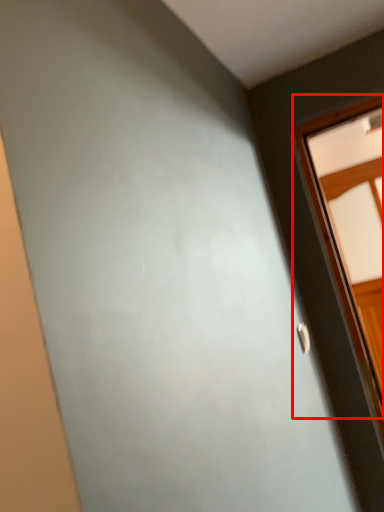
Question: From the image, what is the correct spatial relationship of window (annotated by the red box) in relation to door handle?

Choices:
 (A) right
 (B) left

Answer: (A)